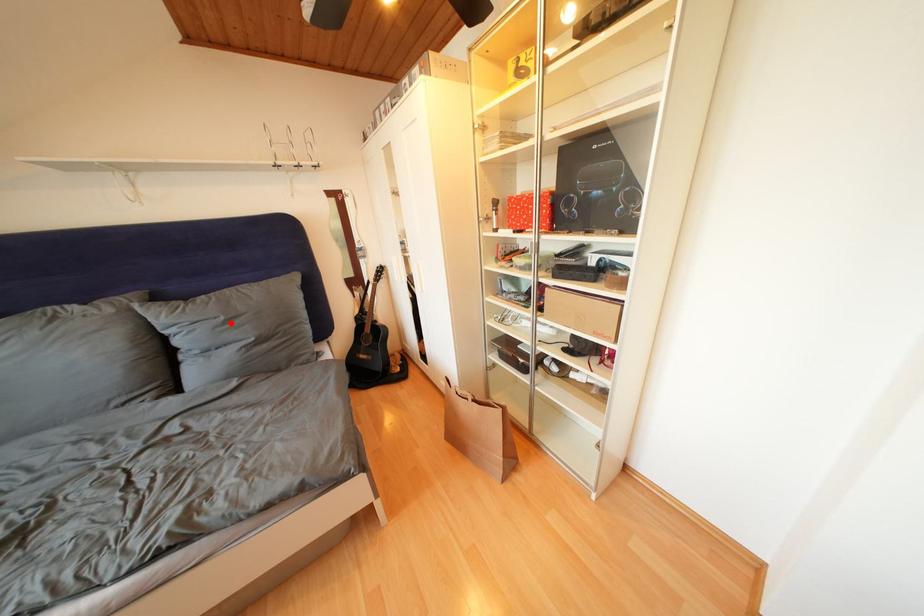
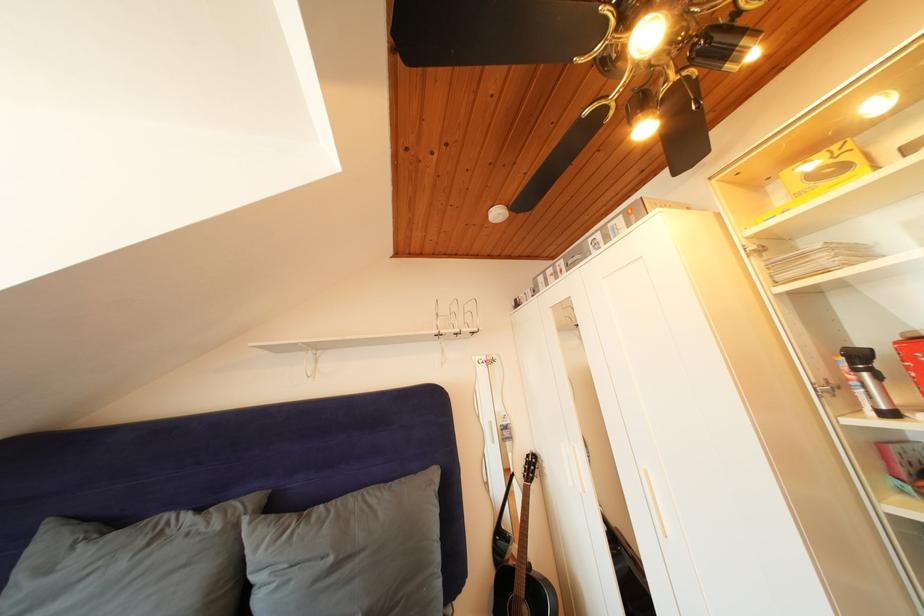
The point at the highlighted location is marked in the first image. Where is the corresponding point in the second image?

(338, 565)